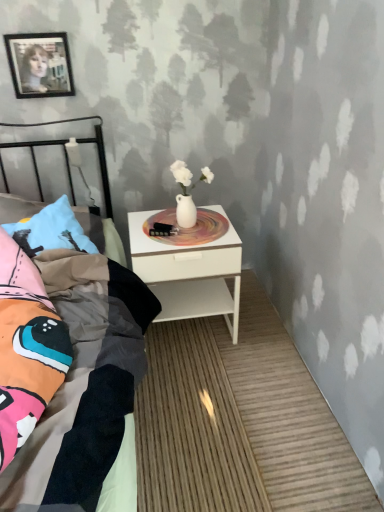
Question: In the image, is white glossy nightstand at center positioned in front of or behind multicolored fabric bed at left?

Choices:
 (A) behind
 (B) front

Answer: (A)

Question: Based on their positions, is white glossy nightstand at center located to the left or right of multicolored fabric bed at left?

Choices:
 (A) right
 (B) left

Answer: (A)

Question: Based on their relative distances, which object is nearer to the multicolored fabric bed at left?

Choices:
 (A) white glossy nightstand at center
 (B) black glossy picture frame at upper left

Answer: (A)

Question: Which object is the farthest from the multicolored fabric bed at left?

Choices:
 (A) black glossy picture frame at upper left
 (B) white glossy nightstand at center

Answer: (A)